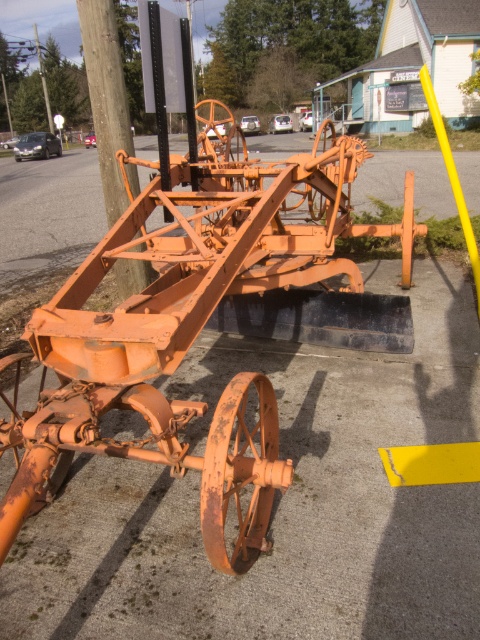
Question: Can you confirm if rusty orange tractor at center is positioned to the right of brushed metal telegraph pole at upper left?

Choices:
 (A) yes
 (B) no

Answer: (A)

Question: Can you confirm if rusty orange tractor at center is thinner than brushed metal telegraph pole at upper left?

Choices:
 (A) no
 (B) yes

Answer: (B)

Question: In this image, where is rusty orange tractor at center located relative to brushed metal telegraph pole at upper left?

Choices:
 (A) above
 (B) below

Answer: (B)

Question: Among these objects, which one is nearest to the camera?

Choices:
 (A) rusty orange tractor at center
 (B) brushed metal telegraph pole at upper left

Answer: (A)

Question: Which point is closer to the camera?

Choices:
 (A) (36, 24)
 (B) (61, 328)

Answer: (B)